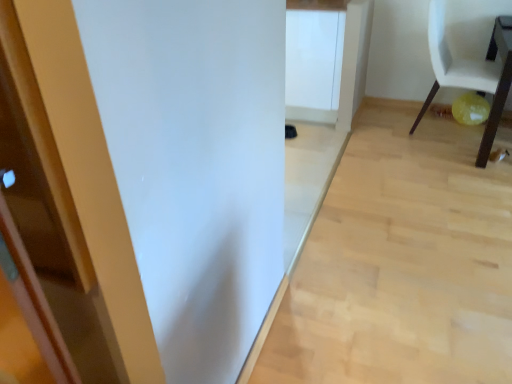
Question: Can you confirm if light wood floor at center is taller than wooden table at lower right?

Choices:
 (A) no
 (B) yes

Answer: (A)

Question: Considering the relative sizes of light wood floor at center and wooden table at lower right in the image provided, is light wood floor at center thinner than wooden table at lower right?

Choices:
 (A) yes
 (B) no

Answer: (B)

Question: From a real-world perspective, is light wood floor at center below wooden table at lower right?

Choices:
 (A) no
 (B) yes

Answer: (B)

Question: Are light wood floor at center and wooden table at lower right located far from each other?

Choices:
 (A) no
 (B) yes

Answer: (A)

Question: Does light wood floor at center have a smaller size compared to wooden table at lower right?

Choices:
 (A) no
 (B) yes

Answer: (B)

Question: Is wooden table at lower right inside light wood floor at center?

Choices:
 (A) no
 (B) yes

Answer: (A)

Question: Can we say wooden table at lower right lies outside white matte chair at right?

Choices:
 (A) no
 (B) yes

Answer: (B)

Question: From the image's perspective, is wooden table at lower right under white matte chair at right?

Choices:
 (A) no
 (B) yes

Answer: (B)

Question: Is white matte chair at right surrounded by wooden table at lower right?

Choices:
 (A) no
 (B) yes

Answer: (A)

Question: Is wooden table at lower right bigger than white matte chair at right?

Choices:
 (A) yes
 (B) no

Answer: (B)

Question: Can you confirm if wooden table at lower right is smaller than white matte chair at right?

Choices:
 (A) yes
 (B) no

Answer: (A)

Question: Considering the relative positions of wooden table at lower right and white matte chair at right in the image provided, is wooden table at lower right to the left of white matte chair at right from the viewer's perspective?

Choices:
 (A) yes
 (B) no

Answer: (B)

Question: From the image's perspective, does white matte cabinet at center appear lower than white matte chair at right?

Choices:
 (A) no
 (B) yes

Answer: (A)